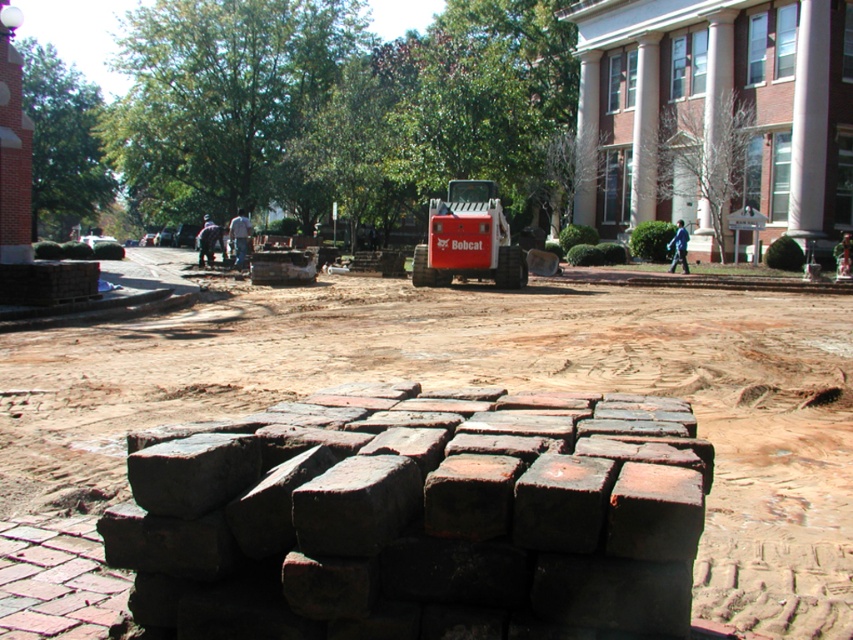
You are a construction worker who needs to place a new dark red brick at center onto the brown dirt field at center. Based on the scene description, can you determine the direction you should move the brick to reach the dirt field?

The brown dirt field at center is to the left of the dark red brick at center, so you should move the dark red brick at center to the left to place it onto the brown dirt field at center.

You are a construction worker who needs to move a heavy equipment from the brown dirt field at center to the red rubber bobcat at center. Which direction should you move the equipment to reach the Bobcat?

The brown dirt field at center is positioned on the left side of the red rubber bobcat at center, so you should move the equipment to the right to reach the Bobcat.